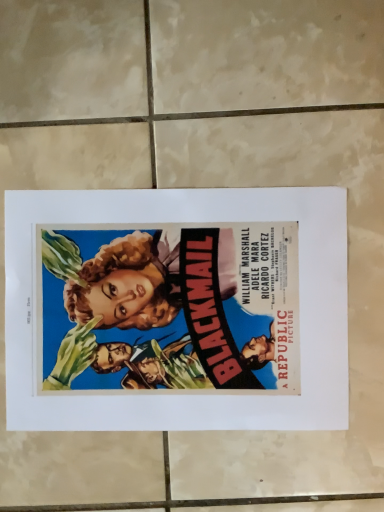
This screenshot has height=512, width=384. Find the location of `blank space above matte paper poster at center (from a real-world perspective)`. blank space above matte paper poster at center (from a real-world perspective) is located at coordinates pos(181,315).